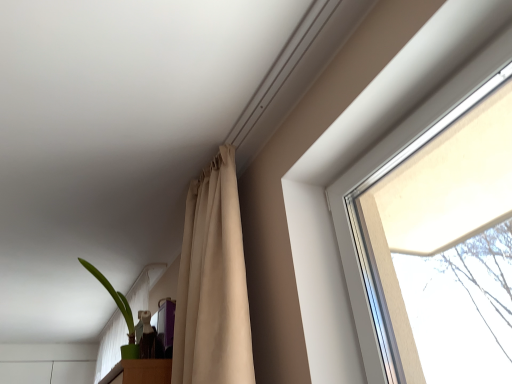
Question: Considering the positions of green matte plant pot at lower left and beige fabric curtain at upper center in the image, is green matte plant pot at lower left bigger or smaller than beige fabric curtain at upper center?

Choices:
 (A) big
 (B) small

Answer: (B)

Question: Is point (105, 357) closer or farther from the camera than point (205, 331)?

Choices:
 (A) closer
 (B) farther

Answer: (B)

Question: Considering their positions, is green matte plant pot at lower left located in front of or behind beige fabric curtain at upper center?

Choices:
 (A) behind
 (B) front

Answer: (A)

Question: From a real-world perspective, is beige fabric curtain at upper center above or below green matte plant pot at lower left?

Choices:
 (A) below
 (B) above

Answer: (A)

Question: Is beige fabric curtain at upper center to the left or to the right of green matte plant pot at lower left in the image?

Choices:
 (A) left
 (B) right

Answer: (B)

Question: Considering the positions of beige fabric curtain at upper center and green matte plant pot at lower left in the image, is beige fabric curtain at upper center wider or thinner than green matte plant pot at lower left?

Choices:
 (A) wide
 (B) thin

Answer: (A)

Question: In terms of height, does beige fabric curtain at upper center look taller or shorter compared to green matte plant pot at lower left?

Choices:
 (A) tall
 (B) short

Answer: (A)